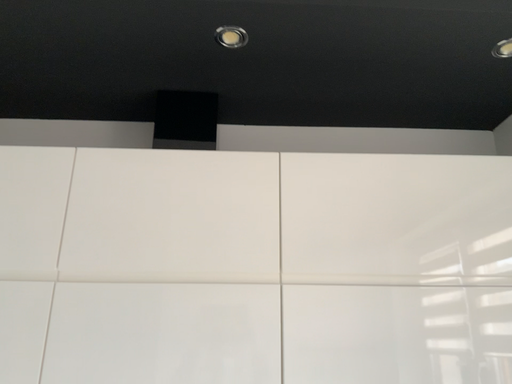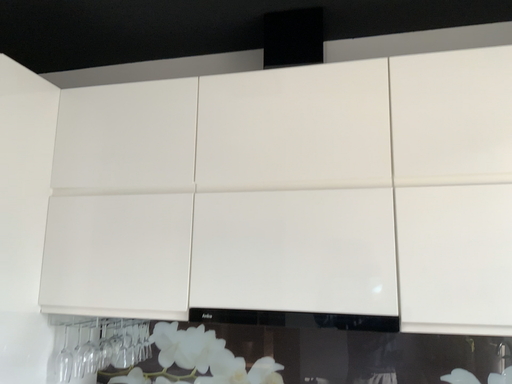
Question: Which way did the camera rotate in the video?

Choices:
 (A) rotated left
 (B) rotated right

Answer: (A)